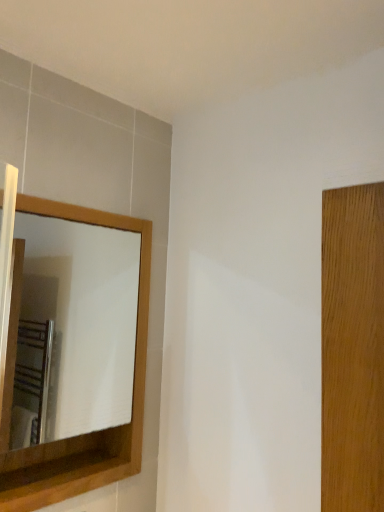
Find the location of a particular element. wooden-framed mirror at left is located at coordinates (77, 326).

What do you see at coordinates (77, 326) in the screenshot? The image size is (384, 512). I see `wooden-framed mirror at left` at bounding box center [77, 326].

The height and width of the screenshot is (512, 384). What are the coordinates of `wooden-framed mirror at left` in the screenshot? It's located at (77, 326).